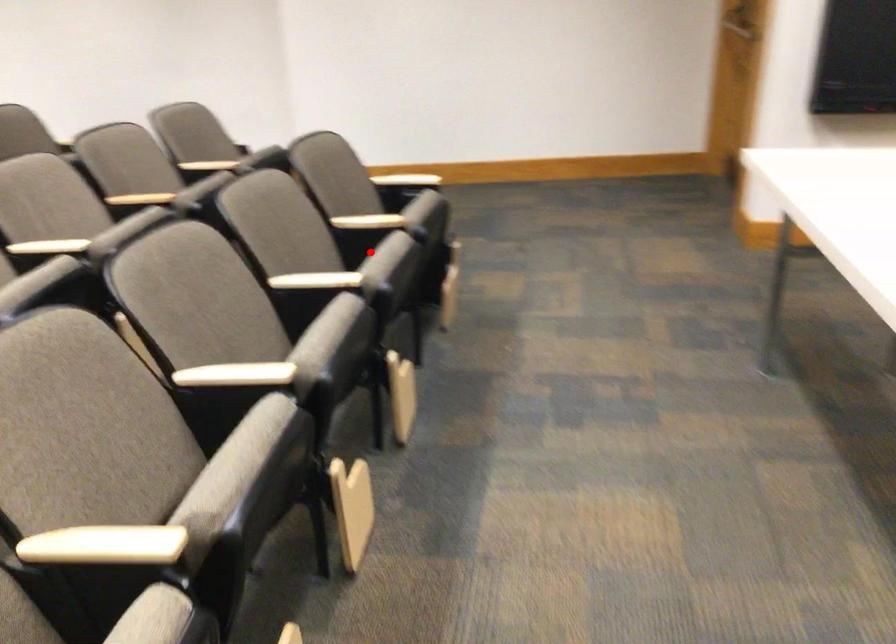
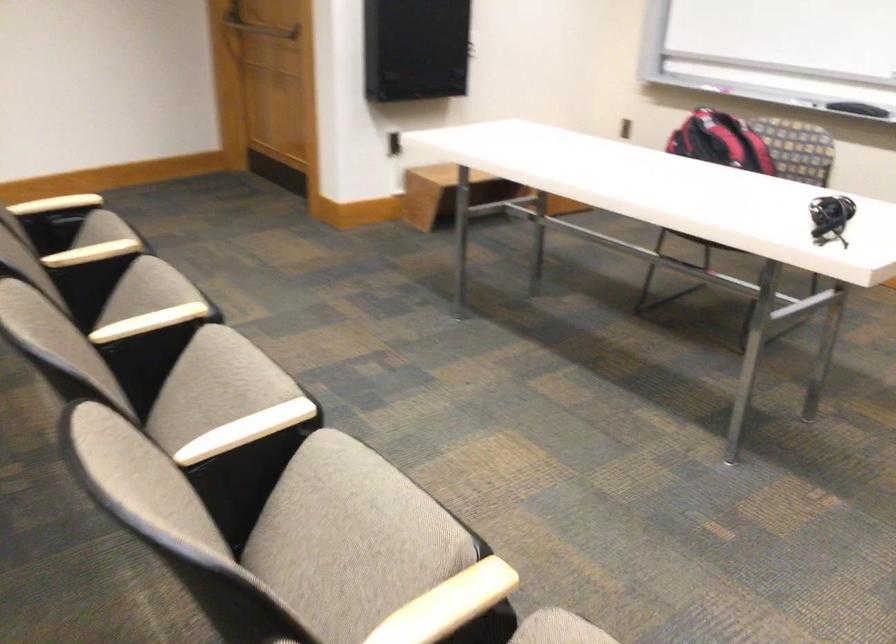
Find the pixel in the second image that matches the highlighted location in the first image.

(147, 290)